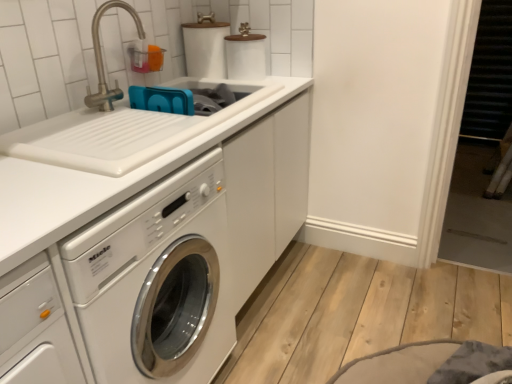
Question: Does brushed metal faucet at upper left have a lesser width compared to white matte toilet paper at upper center?

Choices:
 (A) no
 (B) yes

Answer: (B)

Question: Could white matte toilet paper at upper center be considered to be inside brushed metal faucet at upper left?

Choices:
 (A) yes
 (B) no

Answer: (B)

Question: Is brushed metal faucet at upper left positioned in front of white matte toilet paper at upper center?

Choices:
 (A) no
 (B) yes

Answer: (B)

Question: From a real-world perspective, does brushed metal faucet at upper left sit lower than white matte toilet paper at upper center?

Choices:
 (A) yes
 (B) no

Answer: (B)

Question: Can you confirm if brushed metal faucet at upper left is positioned to the left of white matte toilet paper at upper center?

Choices:
 (A) no
 (B) yes

Answer: (B)

Question: Can you confirm if brushed metal faucet at upper left is wider than white matte toilet paper at upper center?

Choices:
 (A) yes
 (B) no

Answer: (B)

Question: Is white matte toilet paper at upper center touching white glossy washing machine at center-left?

Choices:
 (A) yes
 (B) no

Answer: (B)

Question: Can you confirm if white matte toilet paper at upper center is taller than white glossy washing machine at center-left?

Choices:
 (A) yes
 (B) no

Answer: (B)

Question: Can you confirm if white matte toilet paper at upper center is smaller than white glossy washing machine at center-left?

Choices:
 (A) yes
 (B) no

Answer: (A)

Question: From the image's perspective, is white matte toilet paper at upper center located above white glossy washing machine at center-left?

Choices:
 (A) yes
 (B) no

Answer: (A)

Question: Considering the relative sizes of white matte toilet paper at upper center and white glossy washing machine at center-left in the image provided, is white matte toilet paper at upper center shorter than white glossy washing machine at center-left?

Choices:
 (A) no
 (B) yes

Answer: (B)

Question: Considering the relative sizes of white matte toilet paper at upper center and white glossy washing machine at center-left in the image provided, is white matte toilet paper at upper center wider than white glossy washing machine at center-left?

Choices:
 (A) yes
 (B) no

Answer: (B)

Question: Is white glossy sink at upper left smaller than white matte toilet paper at upper center?

Choices:
 (A) yes
 (B) no

Answer: (B)